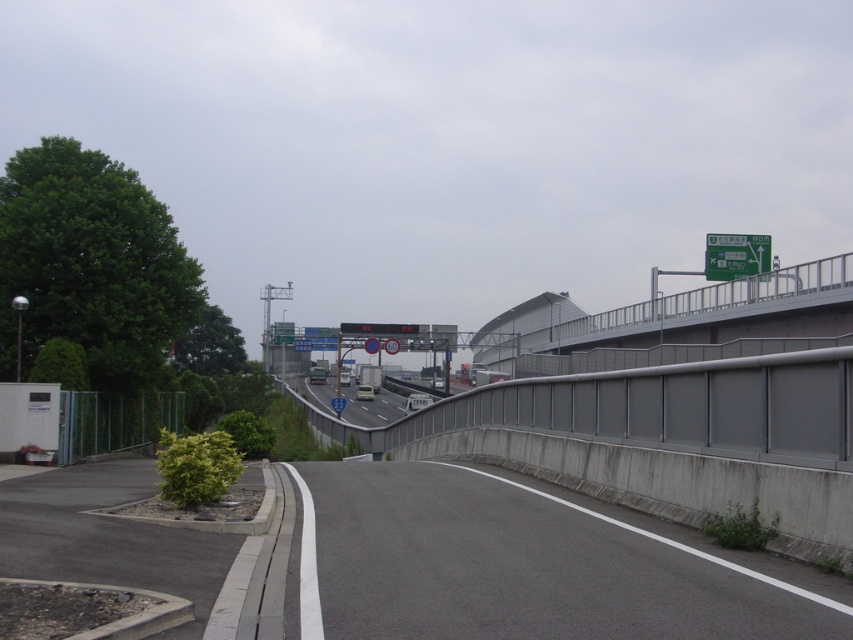
In the scene shown: You are a driver approaching the gray asphalt road at center and want to see the green plastic traffic sign at upper right. Is the traffic sign visible from your current position?

The gray asphalt road at center is shorter than the green plastic traffic sign at upper right, so the traffic sign is taller and likely visible from your current position.

You are driving a car and see the gray asphalt road at center and the green plastic traffic sign at upper right. Which object is located lower in the image?

The gray asphalt road at center is located lower than the green plastic traffic sign at upper right.

You are a pedestrian standing on the walkway next to the highway. You notice two points marked on the road. Which point is closer to you, the point at coordinate (633,628) or the point at (769,250)?

The point at coordinate (633,628) is closer to you than the point at (769,250).